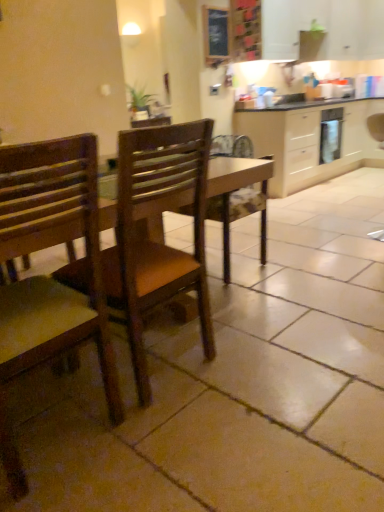
Question: Can you confirm if wooden frame at upper center is positioned to the right of beige wood cabinetry at upper right?

Choices:
 (A) no
 (B) yes

Answer: (A)

Question: Can you confirm if wooden frame at upper center is thinner than beige wood cabinetry at upper right?

Choices:
 (A) no
 (B) yes

Answer: (B)

Question: Considering the relative positions of wooden frame at upper center and beige wood cabinetry at upper right in the image provided, is wooden frame at upper center behind beige wood cabinetry at upper right?

Choices:
 (A) yes
 (B) no

Answer: (B)

Question: Is wooden frame at upper center outside beige wood cabinetry at upper right?

Choices:
 (A) no
 (B) yes

Answer: (B)

Question: Considering the relative sizes of wooden frame at upper center and beige wood cabinetry at upper right in the image provided, is wooden frame at upper center wider than beige wood cabinetry at upper right?

Choices:
 (A) yes
 (B) no

Answer: (B)

Question: Is wooden frame at upper center inside the boundaries of beige wood cabinetry at upper right, or outside?

Choices:
 (A) inside
 (B) outside

Answer: (B)

Question: Is point (203, 13) positioned closer to the camera than point (288, 166)?

Choices:
 (A) farther
 (B) closer

Answer: (B)

Question: Looking at their shapes, would you say wooden frame at upper center is wider or thinner than beige wood cabinetry at upper right?

Choices:
 (A) wide
 (B) thin

Answer: (B)

Question: Is wooden frame at upper center to the left or to the right of beige wood cabinetry at upper right in the image?

Choices:
 (A) right
 (B) left

Answer: (B)

Question: Based on their sizes in the image, would you say wooden chair at center, the second chair positioned from the left, is bigger or smaller than wooden chair at left, the second chair in the right-to-left sequence?

Choices:
 (A) small
 (B) big

Answer: (B)

Question: In terms of height, does wooden chair at center, which is the 1th chair in right-to-left order, look taller or shorter compared to wooden chair at left, the first chair when ordered from left to right?

Choices:
 (A) short
 (B) tall

Answer: (A)

Question: From the image's perspective, is wooden chair at center, which is the 1th chair in right-to-left order, located above or below wooden chair at left, the second chair in the right-to-left sequence?

Choices:
 (A) below
 (B) above

Answer: (B)

Question: Considering the relative positions of wooden chair at center, the second chair positioned from the left, and wooden chair at left, the first chair when ordered from left to right, in the image provided, is wooden chair at center, the second chair positioned from the left, to the left or to the right of wooden chair at left, the first chair when ordered from left to right,?

Choices:
 (A) right
 (B) left

Answer: (A)

Question: Relative to beige wood cabinetry at upper right, is wooden chair at center, the second chair positioned from the left, in front or behind?

Choices:
 (A) behind
 (B) front

Answer: (B)

Question: Would you say wooden chair at center, the second chair positioned from the left, is to the left or to the right of beige wood cabinetry at upper right in the picture?

Choices:
 (A) right
 (B) left

Answer: (B)